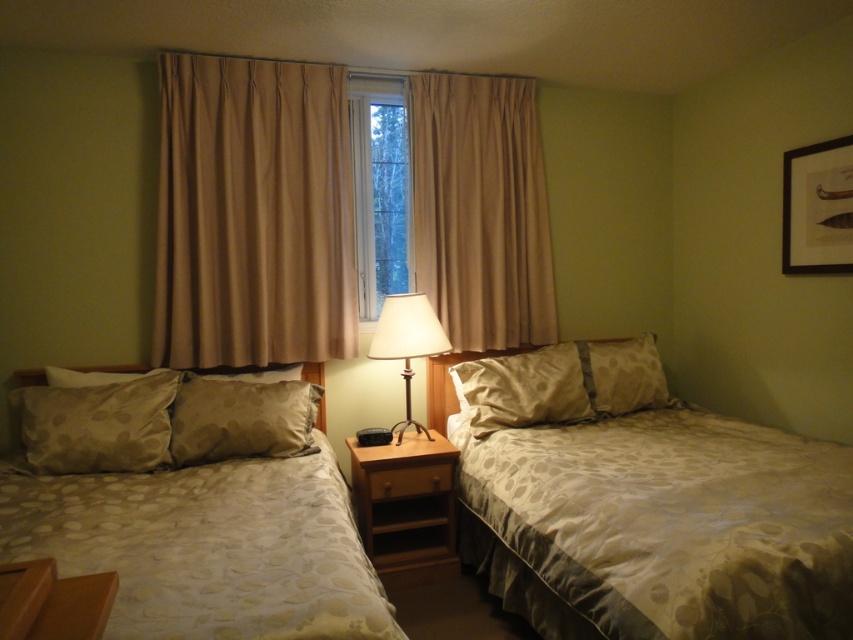
Question: Which point is closer to the camera?

Choices:
 (A) patterned fabric pillow at center
 (B) matte beige fabric lamp at center
 (C) beige dotted pillow at right

Answer: (B)

Question: Is patterned fabric pillow at center to the left of matte beige fabric lamp at center from the viewer's perspective?

Choices:
 (A) yes
 (B) no

Answer: (B)

Question: Which of the following is the farthest from the observer?

Choices:
 (A) (554, 368)
 (B) (428, 435)
 (C) (529, 378)

Answer: (A)

Question: Is silky beige bed at center thinner than clear glass window at center?

Choices:
 (A) yes
 (B) no

Answer: (B)

Question: Which object is positioned closest to the matte beige bed at right?

Choices:
 (A) beige fabric curtain at center
 (B) beige dotted pillow at right

Answer: (B)

Question: Can you confirm if silky beige bed at center is wider than beige dotted pillow at left?

Choices:
 (A) no
 (B) yes

Answer: (B)